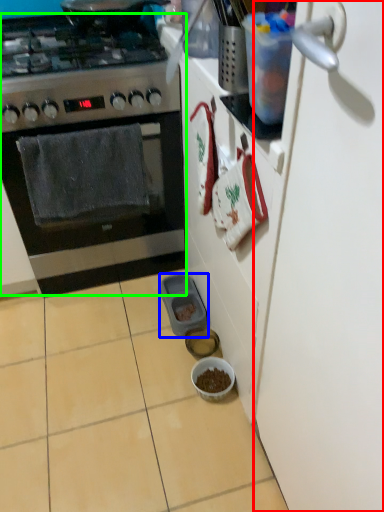
Question: Which object is the farthest from door (highlighted by a red box)? Choose among these: appliance (highlighted by a blue box) or kitchen appliance (highlighted by a green box).

Choices:
 (A) appliance
 (B) kitchen appliance

Answer: (A)